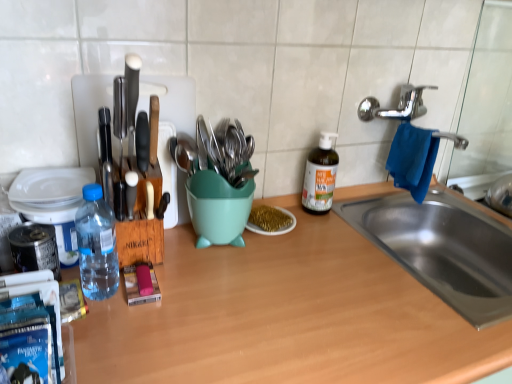
Locate an element on the screen. The height and width of the screenshot is (384, 512). free space in front of gold glitter plate at center is located at coordinates (272, 269).